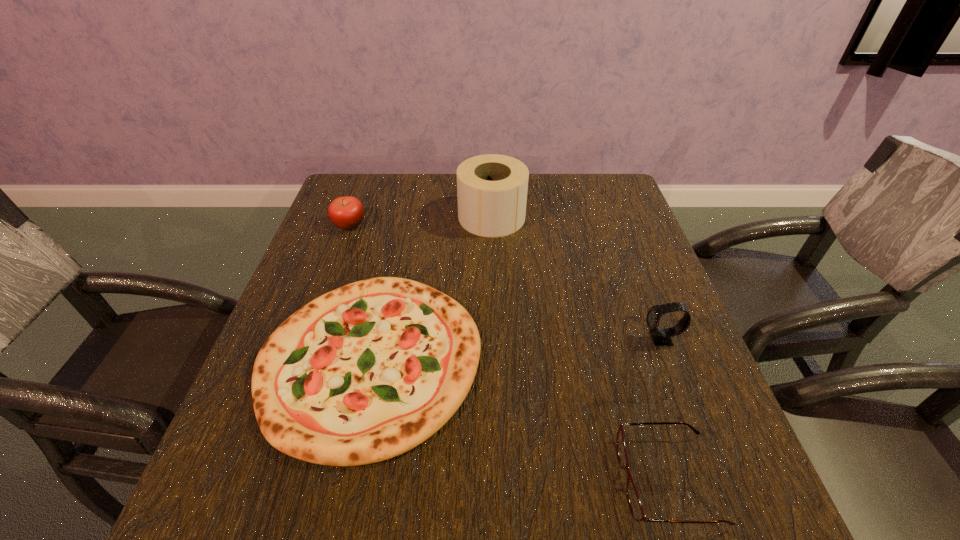
At what (x,y) coordinates should I click in order to perform the action: click on the tallest object. Please return your answer as a coordinate pair (x, y). The image size is (960, 540). Looking at the image, I should click on (492, 189).

In order to click on watch in this screenshot , I will do coord(661,337).

This screenshot has height=540, width=960. Identify the location of apple. (347, 212).

This screenshot has height=540, width=960. Identify the location of pizza. (366, 372).

Identify the location of spectacles. (635, 505).

You are a GUI agent. You are given a task and a screenshot of the screen. Output one action in this format:
    pyautogui.click(x=<x>, y=<y>)
    Task: Click on the free point located 0.270m on the right of the toilet tissue
    The height and width of the screenshot is (540, 960).
    Given the screenshot: What is the action you would take?
    pyautogui.click(x=621, y=217)

Find the location of a particular element. The height and width of the screenshot is (540, 960). free region located 0.220m on the face of the watch is located at coordinates (537, 339).

Where is `blank area located 0.340m on the face of the watch`? blank area located 0.340m on the face of the watch is located at coordinates (480, 339).

I want to click on free space located 0.250m on the face of the watch, so click(x=522, y=339).

This screenshot has height=540, width=960. I want to click on vacant space located 0.210m on the back of the apple, so click(x=367, y=177).